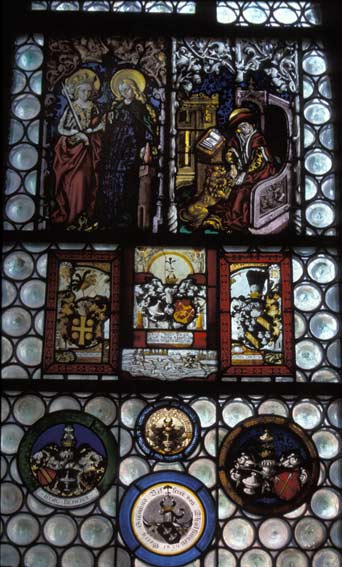
At what (x,y) coordinates should I click in order to perform the action: click on coat. Please return your answer as a coordinate pair (x, y). This screenshot has width=342, height=567. Looking at the image, I should click on (77, 460).